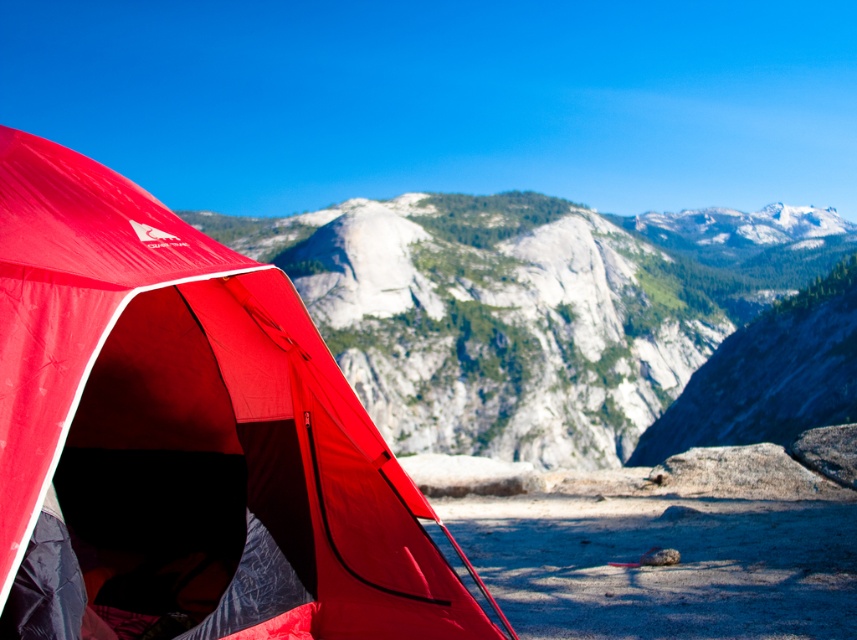
Between matte red tent at left and matte gray rock at center, which one has less height?

matte red tent at left is shorter.

Can you confirm if matte red tent at left is shorter than matte gray rock at center?

Yes, matte red tent at left is shorter than matte gray rock at center.

Is point (13, 508) farther from viewer compared to point (760, 268)?

That is False.

You are a GUI agent. You are given a task and a screenshot of the screen. Output one action in this format:
    pyautogui.click(x=<x>, y=<y>)
    Task: Click on the matte red tent at left
    Image resolution: width=857 pixels, height=640 pixels.
    Given the screenshot: What is the action you would take?
    pyautogui.click(x=189, y=433)